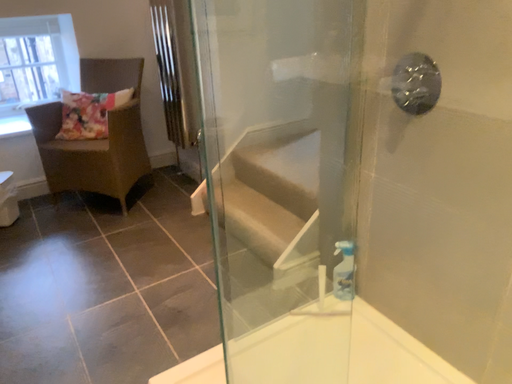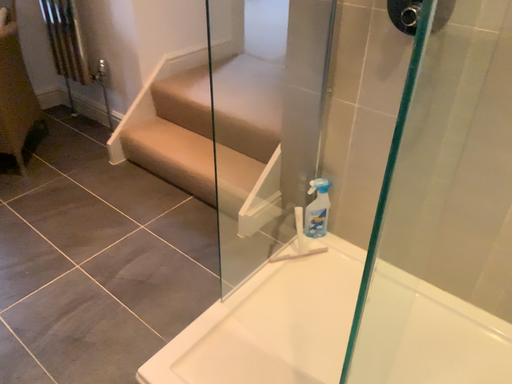
Question: Which way did the camera rotate in the video?

Choices:
 (A) rotated right
 (B) rotated left

Answer: (A)